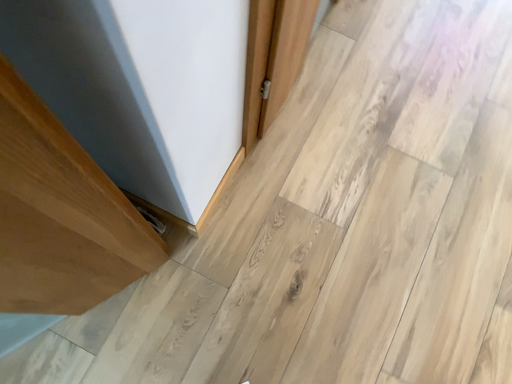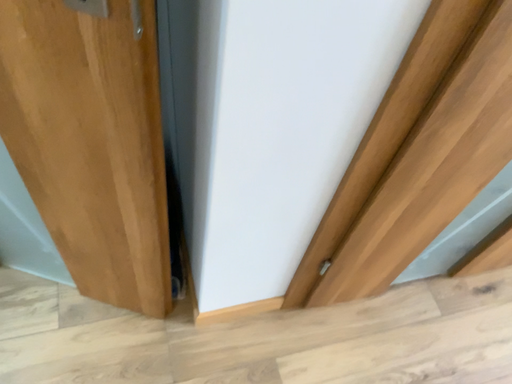
Question: Which way did the camera rotate in the video?

Choices:
 (A) rotated upward
 (B) rotated downward

Answer: (A)